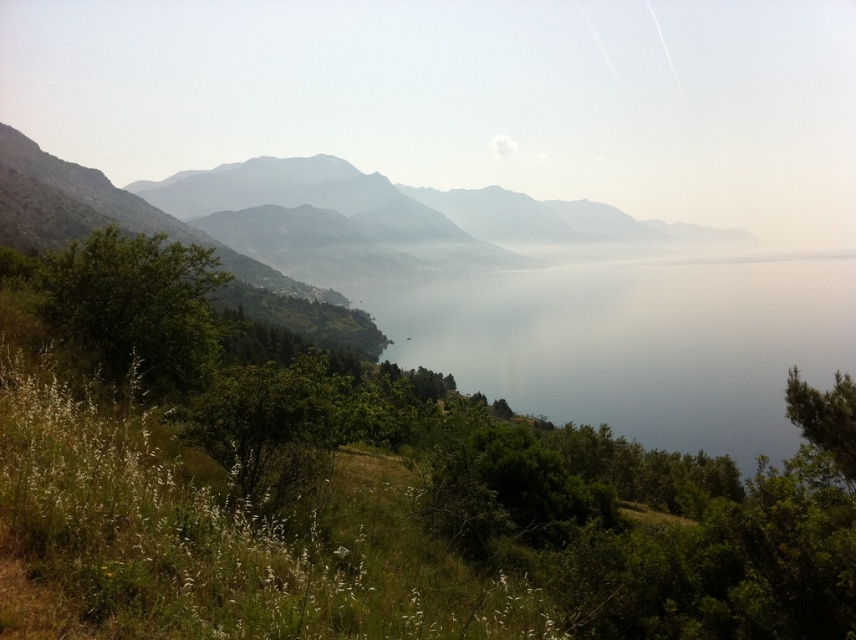
Question: Which object appears farthest from the camera in this image?

Choices:
 (A) green leafy tree at lower left
 (B) green leafy tree at left

Answer: (B)

Question: Is green leafy tree at left bigger than green leafy tree at lower right?

Choices:
 (A) no
 (B) yes

Answer: (B)

Question: Which object is the closest to the green leafy tree at lower right?

Choices:
 (A) transparent water at center
 (B) green leafy tree at lower left
 (C) green leafy tree at left

Answer: (B)

Question: Is the position of green leafy tree at lower left less distant than that of green leafy tree at left?

Choices:
 (A) yes
 (B) no

Answer: (A)

Question: Considering the real-world distances, which object is farthest from the transparent water at center?

Choices:
 (A) green leafy tree at lower left
 (B) green leafy tree at lower right
 (C) green leafy tree at left

Answer: (B)

Question: Does green leafy tree at lower left appear on the right side of transparent water at center?

Choices:
 (A) no
 (B) yes

Answer: (A)